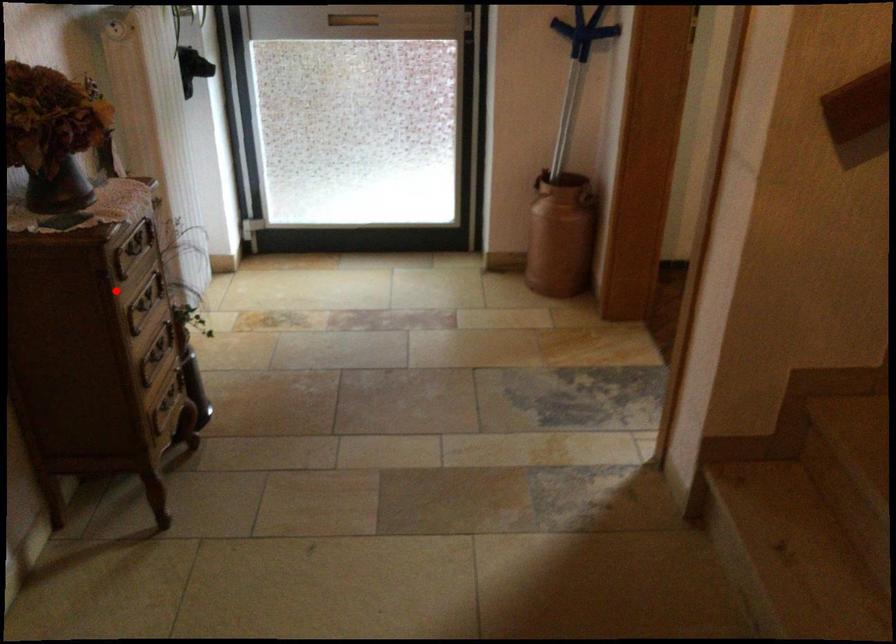
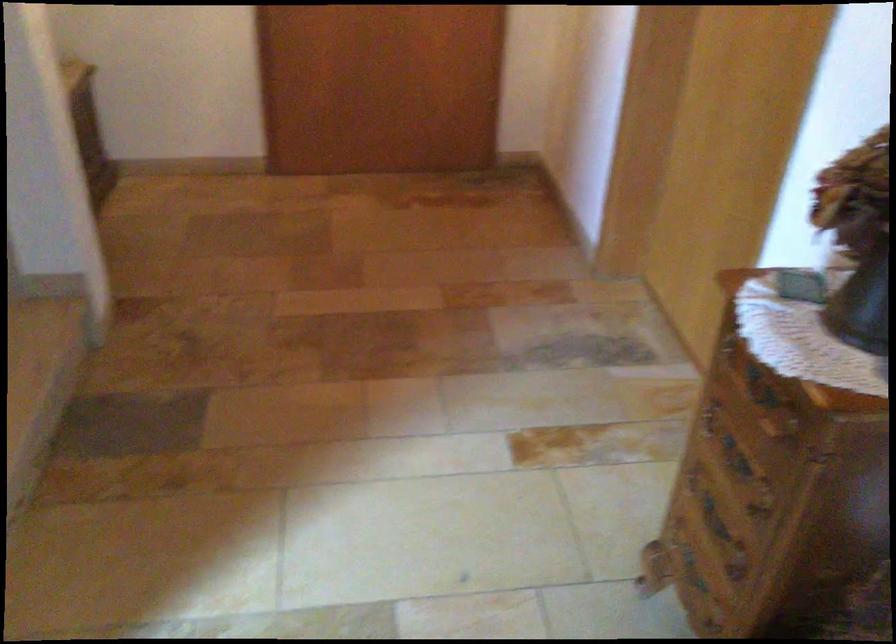
Find the pixel in the second image that matches the highlighted location in the first image.

(760, 386)